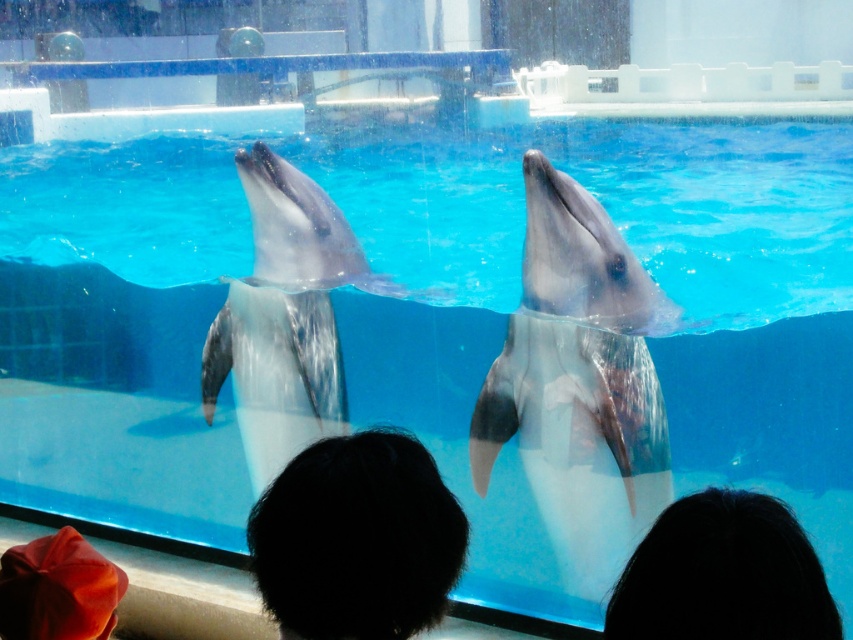
You are a photographer standing at the edge of the dolphin pool. You want to take a photo that includes both the gray matte dolphin at center and the smooth orange hat at lower left. Which object should you focus on first to ensure both are in the frame?

The gray matte dolphin at center is bigger than the smooth orange hat at lower left, so you should focus on the gray matte dolphin at center first to ensure both are in the frame.

You are a photographer standing at the edge of the dolphin pool. You want to capture both the smooth gray dolphin at center and the black hair at lower right in a single shot. Which dolphin should you position closer to the left side of your camera frame to include both subjects?

The smooth gray dolphin at center is positioned on the left side of black hair at lower right, so you should position the smooth gray dolphin at center closer to the left side of your camera frame to include both subjects.

You are a photographer trying to capture a wide shot of the smooth gray dolphin at center and the black hair at lower right. Which object should you focus on first if you want to ensure both are in frame without moving the camera?

The smooth gray dolphin at center is wider than the black hair at lower right, so you should focus on the smooth gray dolphin at center first to ensure both fit in the frame since it takes up more space.